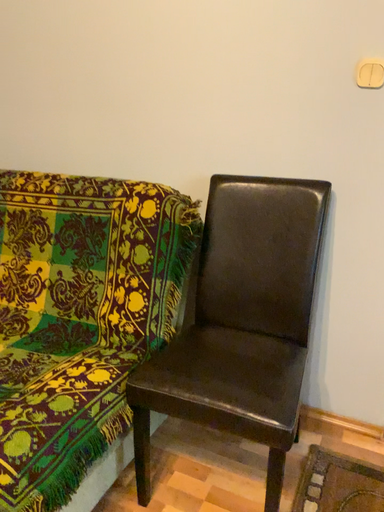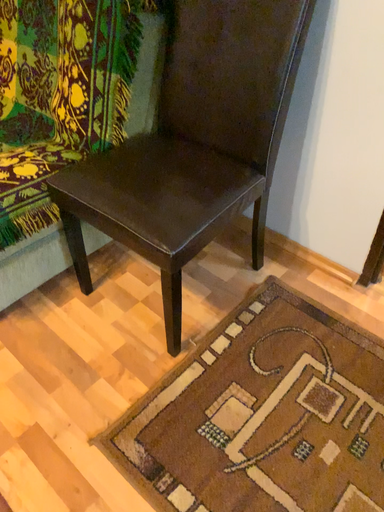
Question: Which way did the camera rotate in the video?

Choices:
 (A) rotated right
 (B) rotated left

Answer: (B)